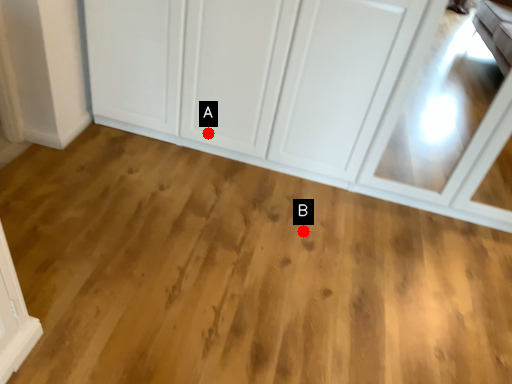
Question: Two points are circled on the image, labeled by A and B beside each circle. Which point is closer to the camera taking this photo?

Choices:
 (A) A is closer
 (B) B is closer

Answer: (B)